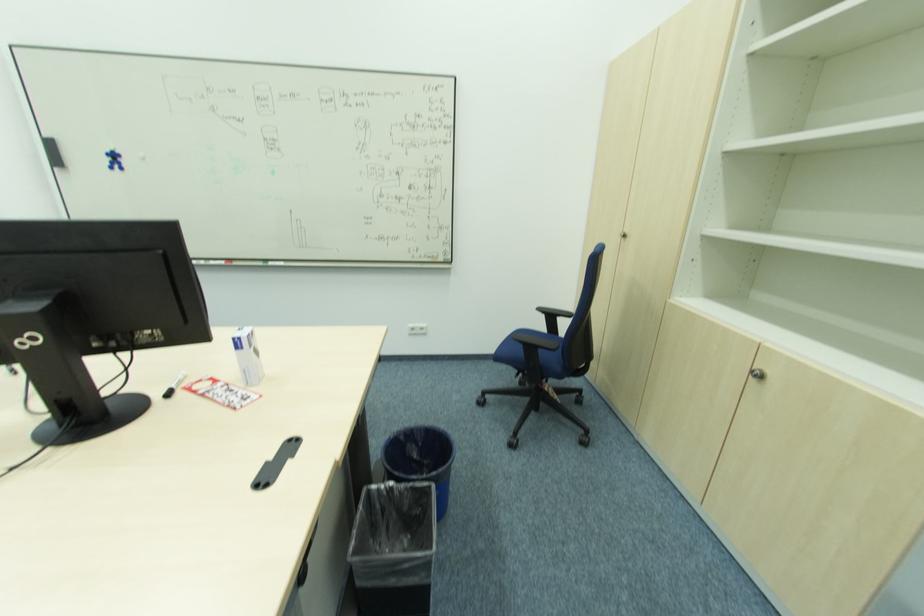
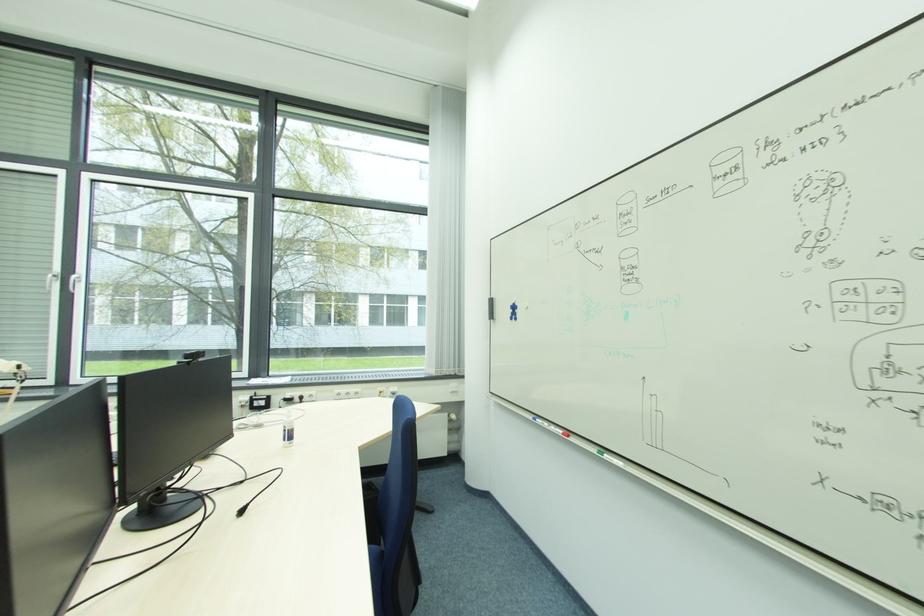
In the second image, find the point that corresponds to (x=274, y=265) in the first image.

(610, 458)